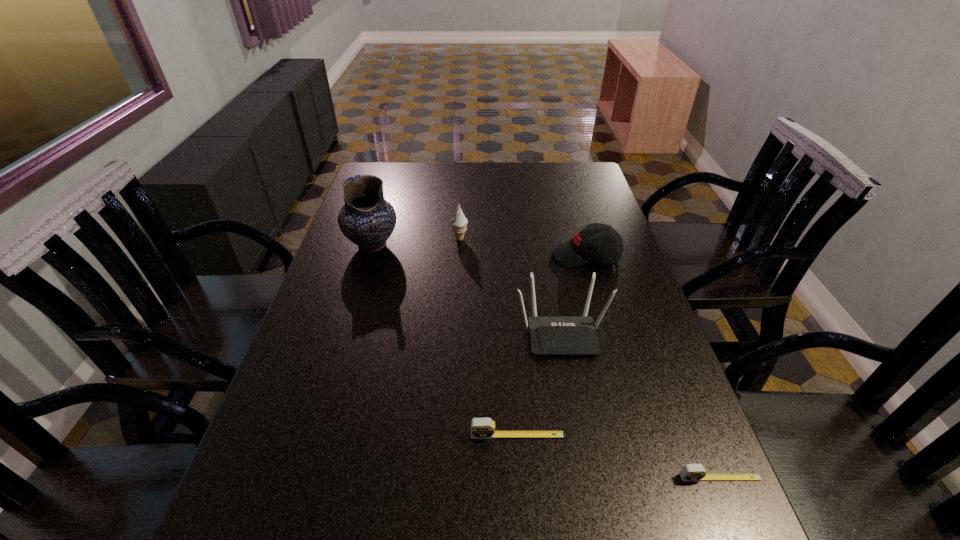
Please point a spot on the left to add another tape measure. Please provide its 2D coordinates. Your answer should be formatted as a tuple, i.e. [(x, y)], where the tuple contains the x and y coordinates of a point satisfying the conditions above.

[(342, 398)]